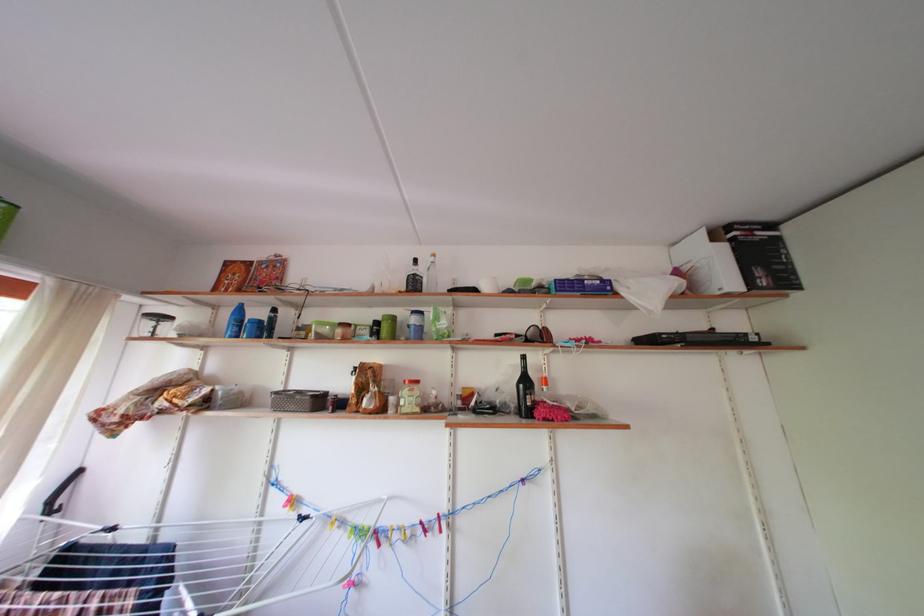
You are a GUI agent. You are given a task and a screenshot of the screen. Output one action in this format:
    pyautogui.click(x=<x>, y=<y>)
    Task: Click on the dark wine bottle
    
    Given the screenshot: What is the action you would take?
    pyautogui.click(x=525, y=391)